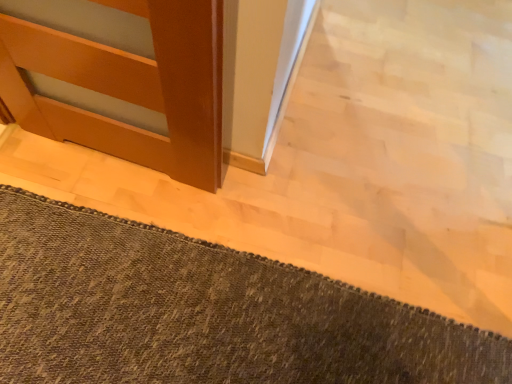
Find the location of a particular element. The width and height of the screenshot is (512, 384). free location to the right of matte wood door at left is located at coordinates [x=240, y=203].